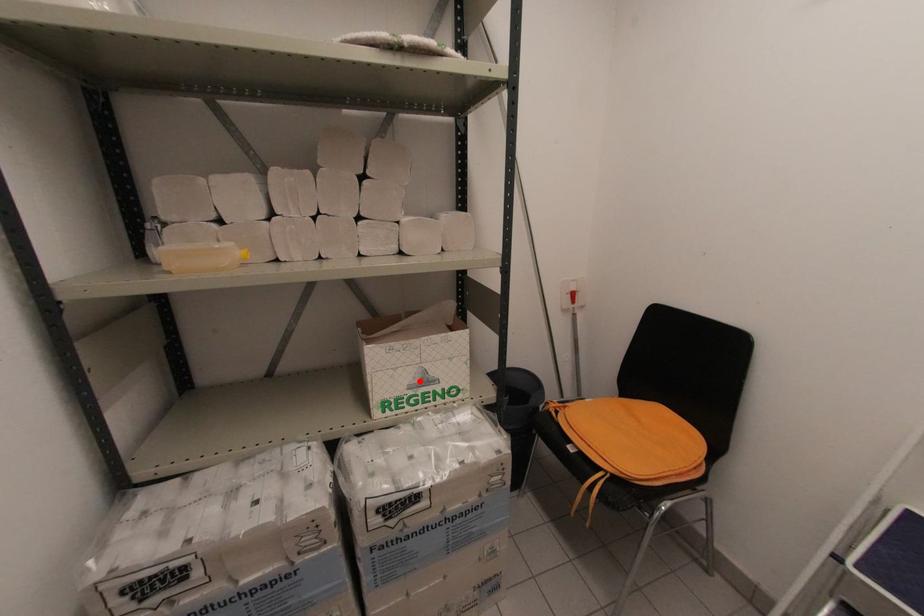
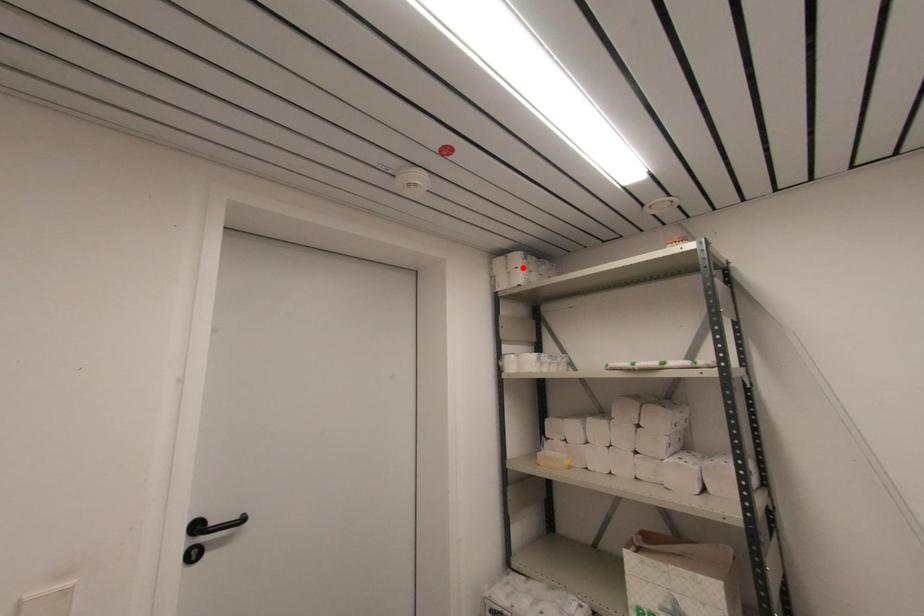
From the picture: I am providing you with two images of the same scene from different viewpoints. A red point is marked on the first image and another point is marked on the second image. Are the points marked in image1 and image2 representing the same 3D position?

No